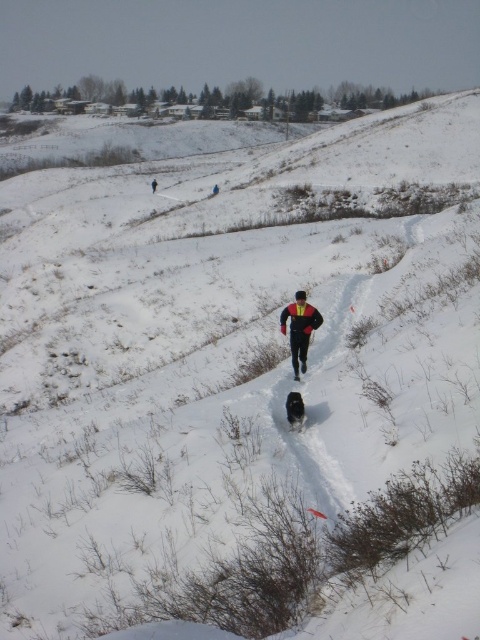
Question: Which of the following is the farthest from the observer?

Choices:
 (A) 301,365
 (B) 156,180

Answer: (B)

Question: Is matte black jacket at center behind black matte jacket at upper center?

Choices:
 (A) yes
 (B) no

Answer: (B)

Question: Does matte black jacket at center have a smaller size compared to black matte jacket at upper center?

Choices:
 (A) no
 (B) yes

Answer: (B)

Question: Which of the following is the closest to the observer?

Choices:
 (A) black matte jacket at upper center
 (B) matte black jacket at center

Answer: (B)

Question: Can you confirm if matte black jacket at center is positioned to the left of black matte jacket at upper center?

Choices:
 (A) yes
 (B) no

Answer: (B)